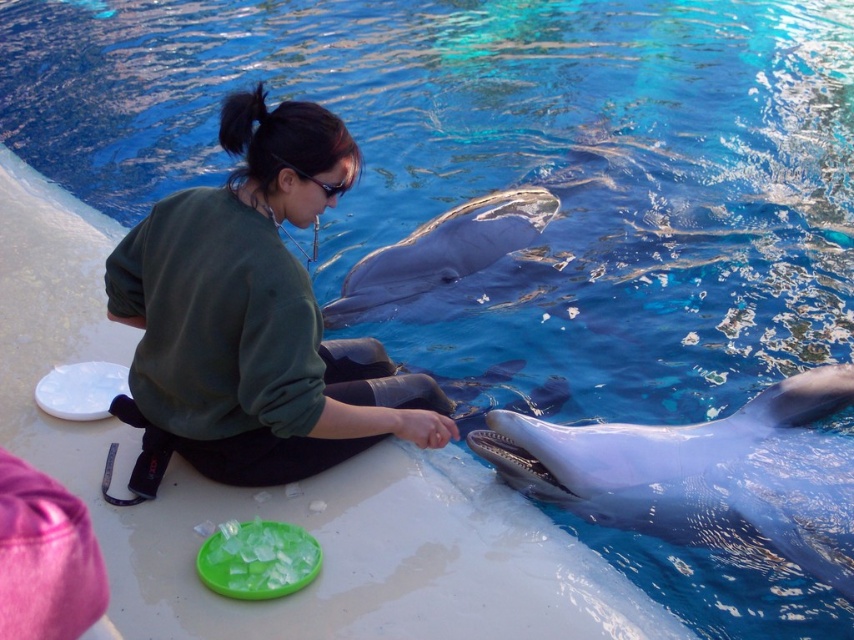
Is green matte sweatshirt at center wider than sleek gray dolphin at center?

Incorrect, green matte sweatshirt at center's width does not surpass sleek gray dolphin at center's.

Identify the location of green matte sweatshirt at center. This screenshot has width=854, height=640. (256, 316).

Find the location of a particular element. Image resolution: width=854 pixels, height=640 pixels. green matte sweatshirt at center is located at coordinates (256, 316).

Which is behind, point (654, 458) or point (408, 301)?

Point (408, 301)

The height and width of the screenshot is (640, 854). I want to click on smooth gray dolphin at lower right, so click(x=702, y=474).

Which is above, green matte sweatshirt at center or smooth gray dolphin at lower right?

green matte sweatshirt at center

Looking at this image, is green matte sweatshirt at center taller than smooth gray dolphin at lower right?

Correct, green matte sweatshirt at center is much taller as smooth gray dolphin at lower right.

Image resolution: width=854 pixels, height=640 pixels. What are the coordinates of `green matte sweatshirt at center` in the screenshot? It's located at (256, 316).